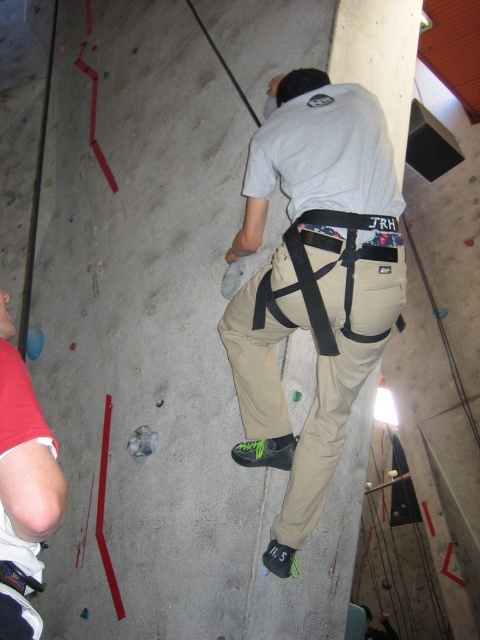
Question: Can you confirm if khaki cotton pants at center is wider than matte khaki pants at lower left?

Choices:
 (A) no
 (B) yes

Answer: (B)

Question: Among these points, which one is farthest from the camera?

Choices:
 (A) (309, 253)
 (B) (64, 484)

Answer: (A)

Question: Which point is closer to the camera?

Choices:
 (A) (321, 429)
 (B) (3, 490)

Answer: (B)

Question: Can you confirm if khaki cotton pants at center is bigger than matte khaki pants at lower left?

Choices:
 (A) no
 (B) yes

Answer: (B)

Question: Which object is closer to the camera taking this photo?

Choices:
 (A) khaki cotton pants at center
 (B) matte khaki pants at lower left

Answer: (B)

Question: Is khaki cotton pants at center bigger than matte khaki pants at lower left?

Choices:
 (A) no
 (B) yes

Answer: (B)